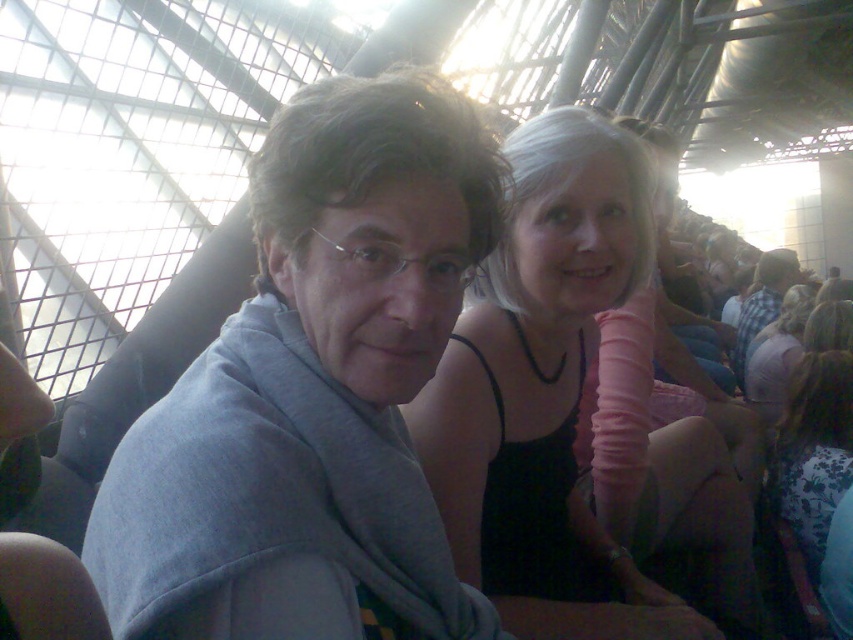
You are standing in the indoor venue and want to determine which of the two points, point (479,534) or point (740,340), is nearer to you. Based on the scene description, which point is closer?

Point (479,534) is closer to the viewer than point (740,340).

You are a photographer adjusting lighting in the venue. You notice two items at the center of the image, the black matte tank top at center and the plaid shirt at center. Which one requires more space to accommodate its size when positioning for a closeup shot?

The black matte tank top at center is larger in size than the plaid shirt at center, so it requires more space to accommodate its size when positioning for a closeup shot.